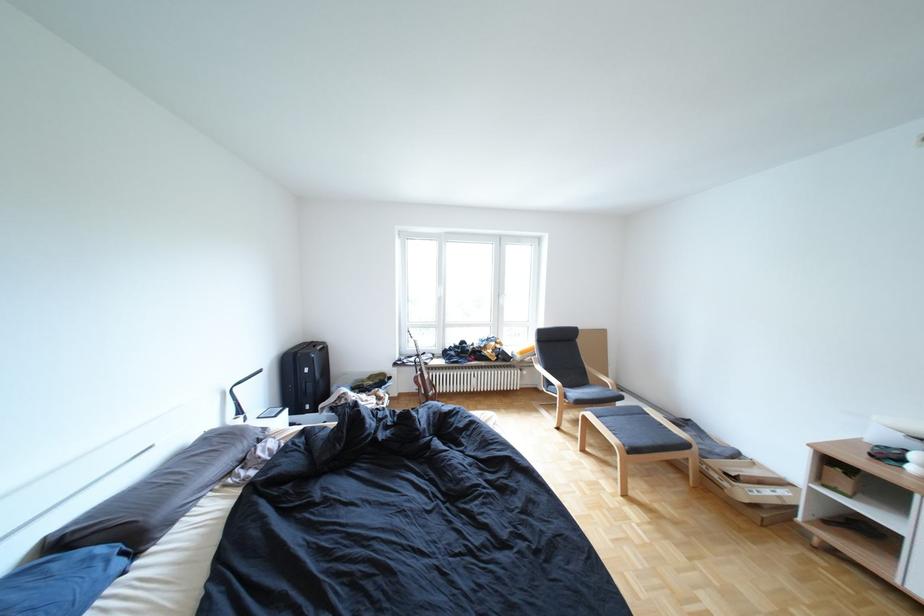
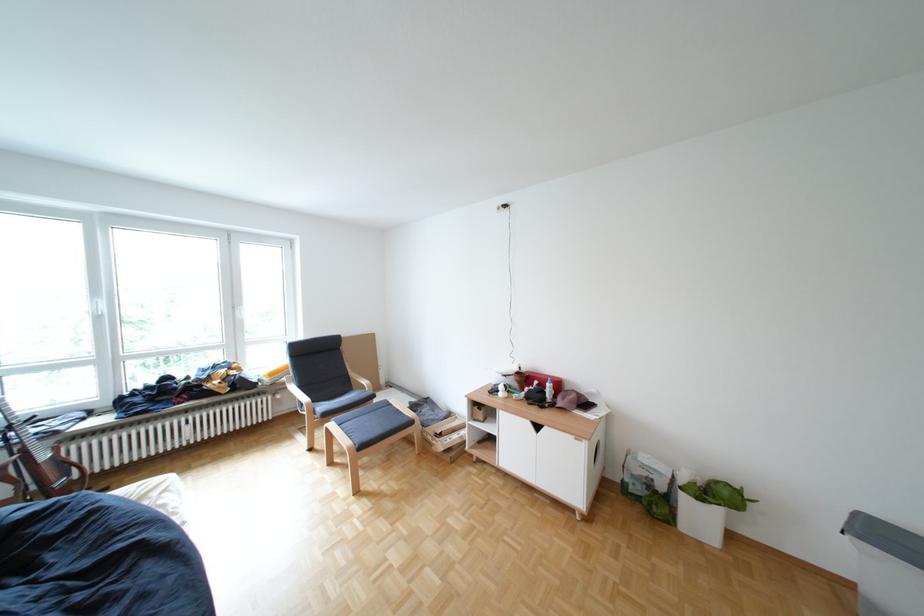
Locate, in the second image, the point that corresponds to (x=537, y=353) in the first image.

(286, 374)